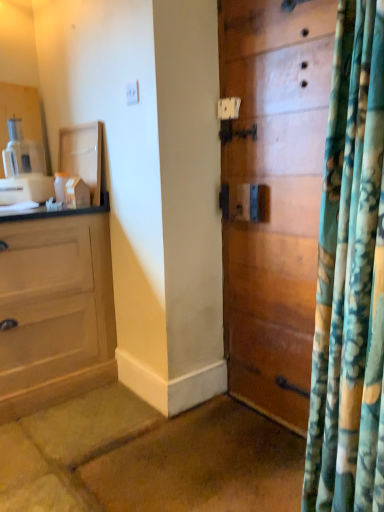
The image size is (384, 512). I want to click on vacant space underneath wooden door at center (from a real-world perspective), so click(263, 419).